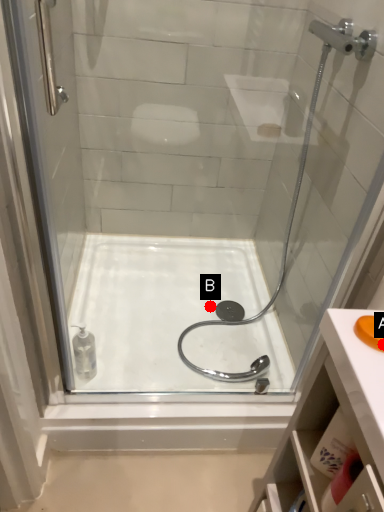
Question: Two points are circled on the image, labeled by A and B beside each circle. Which point is closer to the camera taking this photo?

Choices:
 (A) A is closer
 (B) B is closer

Answer: (A)